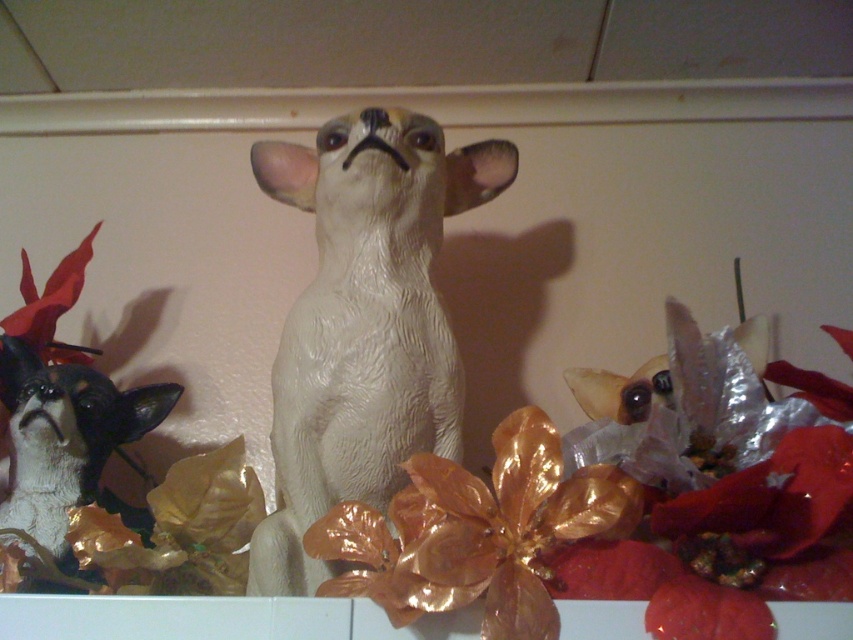
Question: Which point is closer to the camera?

Choices:
 (A) (407, 420)
 (B) (44, 390)

Answer: (A)

Question: Which of the following is the closest to the observer?

Choices:
 (A) white glossy dog at center
 (B) white glossy dog at left

Answer: (A)

Question: Is white glossy dog at center to the right of white glossy dog at left from the viewer's perspective?

Choices:
 (A) no
 (B) yes

Answer: (B)

Question: Is white glossy dog at center above white glossy dog at left?

Choices:
 (A) no
 (B) yes

Answer: (B)

Question: Can you confirm if white glossy dog at center is positioned to the left of white glossy dog at left?

Choices:
 (A) no
 (B) yes

Answer: (A)